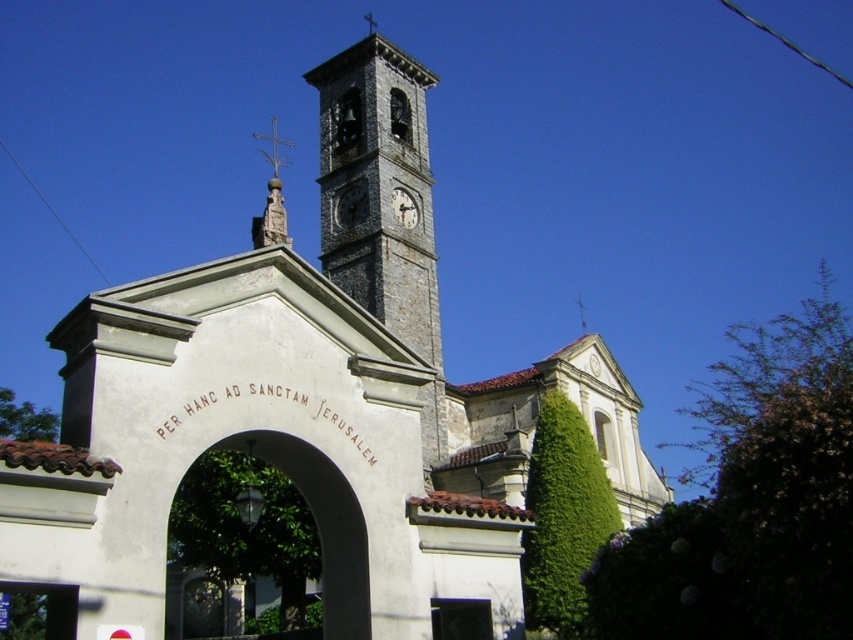
Can you confirm if polished gold cross at center is positioned above gray stone clock at center?

Yes, polished gold cross at center is above gray stone clock at center.

Is polished gold cross at center smaller than gray stone clock at center?

Actually, polished gold cross at center might be larger than gray stone clock at center.

Where is `polished gold cross at center`? Image resolution: width=853 pixels, height=640 pixels. polished gold cross at center is located at coordinates [271, 196].

Does stone clock tower at center appear on the left side of gray stone clock at center?

Correct, you'll find stone clock tower at center to the left of gray stone clock at center.

Is stone clock tower at center thinner than gray stone clock at center?

No.

Is point (415, 195) positioned behind point (392, 204)?

That is True.

At what (x,y) coordinates should I click in order to perform the action: click on stone clock tower at center. Please return your answer as a coordinate pair (x, y). Looking at the image, I should click on click(x=381, y=202).

Does stone clock tower at center have a lesser width compared to polished gold cross at center?

Correct, stone clock tower at center's width is less than polished gold cross at center's.

How much distance is there between stone clock tower at center and polished gold cross at center?

stone clock tower at center is 110.68 feet away from polished gold cross at center.

Is point (376, 70) closer to viewer compared to point (277, 200)?

No.

Locate an element on the screen. This screenshot has width=853, height=640. stone clock tower at center is located at coordinates (381, 202).